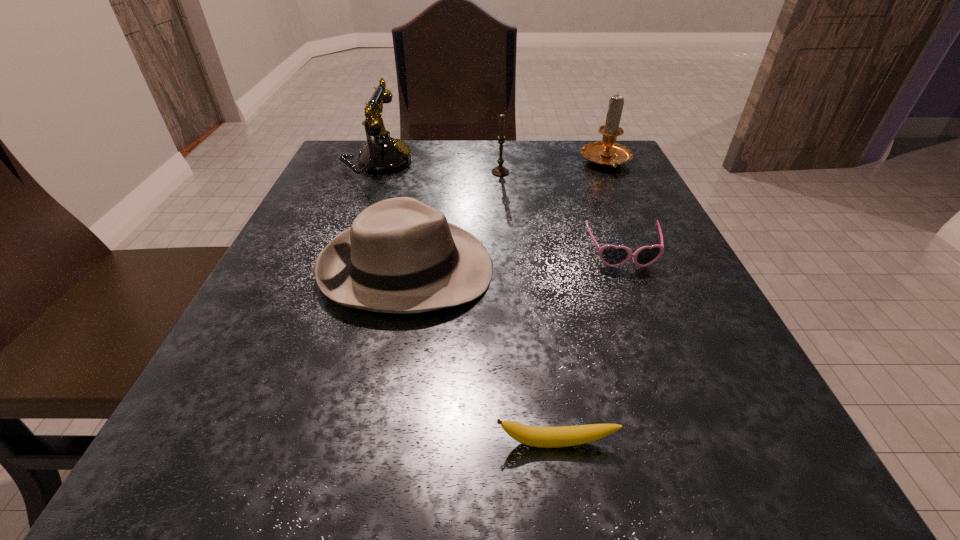
You are a GUI agent. You are given a task and a screenshot of the screen. Output one action in this format:
    pyautogui.click(x=<x>, y=<y>)
    Task: Click on the vacant space located on the front-facing side of the third shortest object
    This screenshot has width=960, height=540.
    Given the screenshot: What is the action you would take?
    pyautogui.click(x=547, y=269)

Locate an element on the screen. Image resolution: width=960 pixels, height=540 pixels. free space located 0.330m on the front-facing side of the sunglasses is located at coordinates (705, 463).

Locate an element on the screen. This screenshot has height=540, width=960. telephone that is at the far edge is located at coordinates (383, 154).

At what (x,y) coordinates should I click in order to perform the action: click on object located in the near edge section of the desktop. Please return your answer as a coordinate pair (x, y). Looking at the image, I should click on (543, 437).

Identify the location of telephone located in the left edge section of the desktop. The width and height of the screenshot is (960, 540). (383, 154).

At what (x,y) coordinates should I click in order to perform the action: click on fedora present at the left edge. Please return your answer as a coordinate pair (x, y). Looking at the image, I should click on (400, 255).

Image resolution: width=960 pixels, height=540 pixels. I want to click on candle located in the right edge section of the desktop, so click(x=607, y=153).

The width and height of the screenshot is (960, 540). Find the location of `sunglasses positioned at the right edge`. sunglasses positioned at the right edge is located at coordinates 611,255.

This screenshot has width=960, height=540. What are the coordinates of `object that is at the far left corner` in the screenshot? It's located at (383, 154).

The height and width of the screenshot is (540, 960). Identify the location of object at the far right corner. (607, 153).